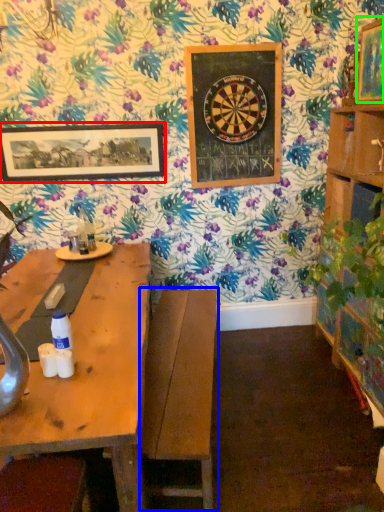
Question: Based on their relative distances, which object is nearer to picture frame (highlighted by a red box)? Choose from swivel chair (highlighted by a blue box) and picture frame (highlighted by a green box).

Choices:
 (A) swivel chair
 (B) picture frame

Answer: (A)